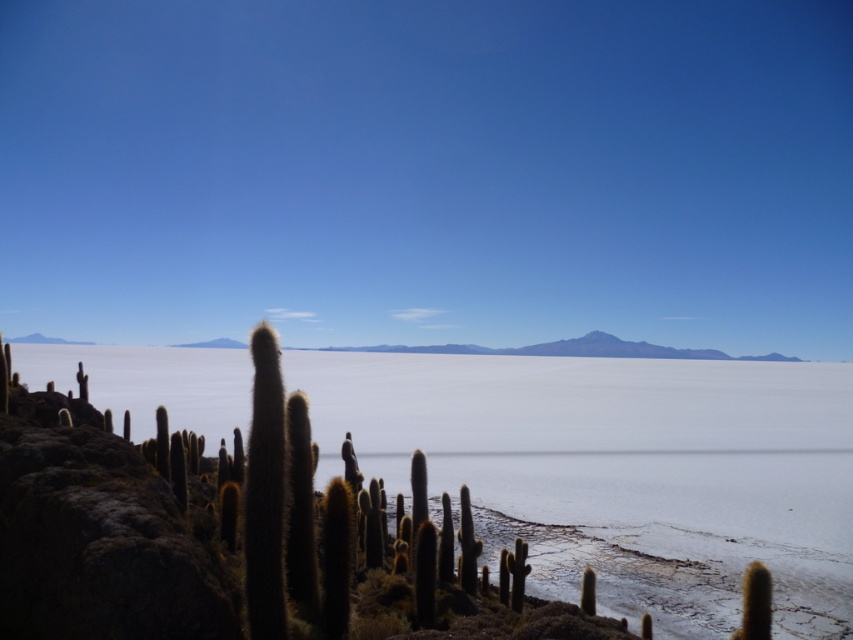
You are standing at the point closest to the camera in the image. Which point are you at, point (x=523, y=502) or point (x=531, y=344)?

Point (x=523, y=502) is in front of point (x=531, y=344), so you are at point (x=523, y=502).

You are standing at the point marked as point (619, 472) in the image. What object is located exactly at that point?

The white matte water at center is located exactly at point (619, 472).